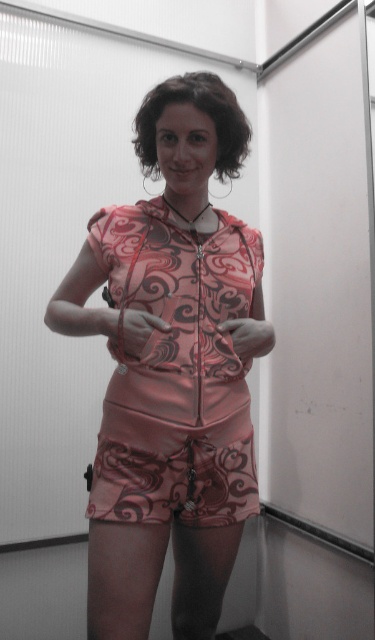
Does satin pink romper at center appear on the right side of pink satin dress at center?

Incorrect, satin pink romper at center is not on the right side of pink satin dress at center.

Between point (243, 154) and point (153, 374), which one is positioned in front?

Positioned in front is point (153, 374).

Between point (166, 515) and point (214, 468), which one is positioned in front?

Point (166, 515) is in front.

Identify the location of satin pink romper at center. (172, 369).

Between pink satin dress at center and pink satin shorts at center, which one has less height?

With less height is pink satin shorts at center.

Can you confirm if pink satin dress at center is smaller than pink satin shorts at center?

Actually, pink satin dress at center might be larger than pink satin shorts at center.

At what (x,y) coordinates should I click in order to perform the action: click on pink satin dress at center. Please return your answer as a coordinate pair (x, y). Image resolution: width=375 pixels, height=640 pixels. Looking at the image, I should click on (177, 372).

Locate an element on the screen. This screenshot has width=375, height=640. pink satin dress at center is located at coordinates (177, 372).

Is satin pink romper at center smaller than pink satin shorts at center?

No.

Is satin pink romper at center in front of pink satin shorts at center?

Yes, it is in front of pink satin shorts at center.

Measure the distance between satin pink romper at center and camera.

satin pink romper at center and camera are 1.09 meters apart from each other.

Find the location of a particular element. This screenshot has width=375, height=640. satin pink romper at center is located at coordinates (172, 369).